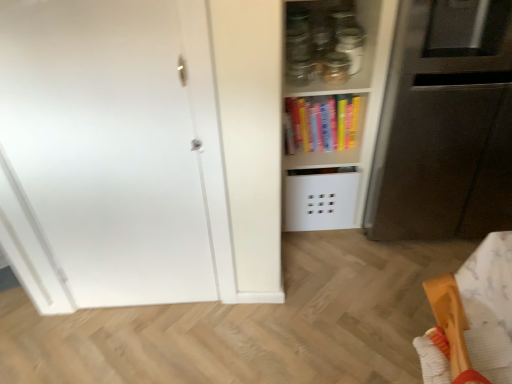
Identify the location of blank space to the left of white matte door at left. (66, 332).